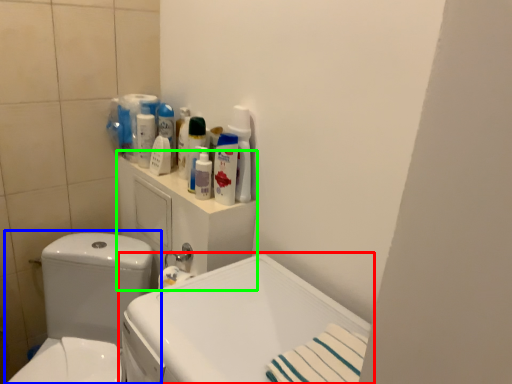
Question: Estimate the real-world distances between objects in this image. Which object is closer to sink (highlighted by a red box), toilet (highlighted by a blue box) or medicine cabinet (highlighted by a green box)?

Choices:
 (A) toilet
 (B) medicine cabinet

Answer: (B)